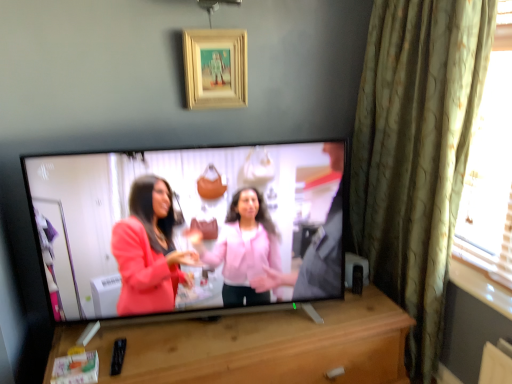
Question: Considering the relative positions of matte black tv at center and wooden cabinet at center in the image provided, is matte black tv at center in front of wooden cabinet at center?

Choices:
 (A) no
 (B) yes

Answer: (A)

Question: From a real-world perspective, is matte black tv at center located higher than wooden cabinet at center?

Choices:
 (A) no
 (B) yes

Answer: (B)

Question: Considering the relative positions of matte black tv at center and wooden cabinet at center in the image provided, is matte black tv at center behind wooden cabinet at center?

Choices:
 (A) yes
 (B) no

Answer: (A)

Question: Does matte black tv at center contain wooden cabinet at center?

Choices:
 (A) yes
 (B) no

Answer: (B)

Question: From the image's perspective, is matte black tv at center located beneath wooden cabinet at center?

Choices:
 (A) no
 (B) yes

Answer: (A)

Question: Is matte black tv at center turned away from wooden cabinet at center?

Choices:
 (A) yes
 (B) no

Answer: (B)

Question: Does green textured curtain at right have a greater width compared to matte black tv at center?

Choices:
 (A) yes
 (B) no

Answer: (A)

Question: Does green textured curtain at right lie behind matte black tv at center?

Choices:
 (A) no
 (B) yes

Answer: (A)

Question: Is green textured curtain at right not inside matte black tv at center?

Choices:
 (A) no
 (B) yes

Answer: (B)

Question: Is green textured curtain at right smaller than matte black tv at center?

Choices:
 (A) yes
 (B) no

Answer: (B)

Question: Is green textured curtain at right next to matte black tv at center and touching it?

Choices:
 (A) yes
 (B) no

Answer: (B)

Question: Does green textured curtain at right have a lesser width compared to matte black tv at center?

Choices:
 (A) no
 (B) yes

Answer: (A)

Question: Does matte black tv at center come in front of green textured curtain at right?

Choices:
 (A) yes
 (B) no

Answer: (B)